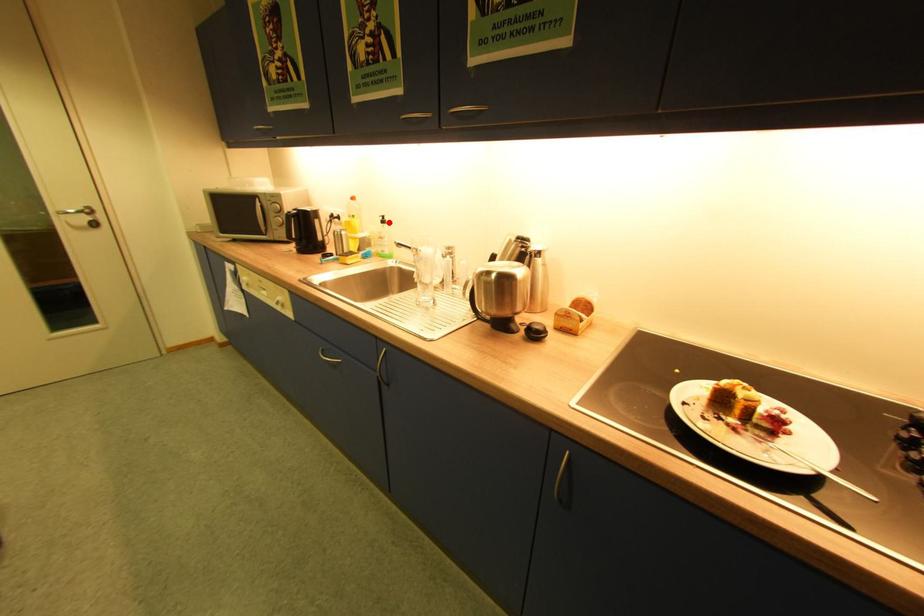
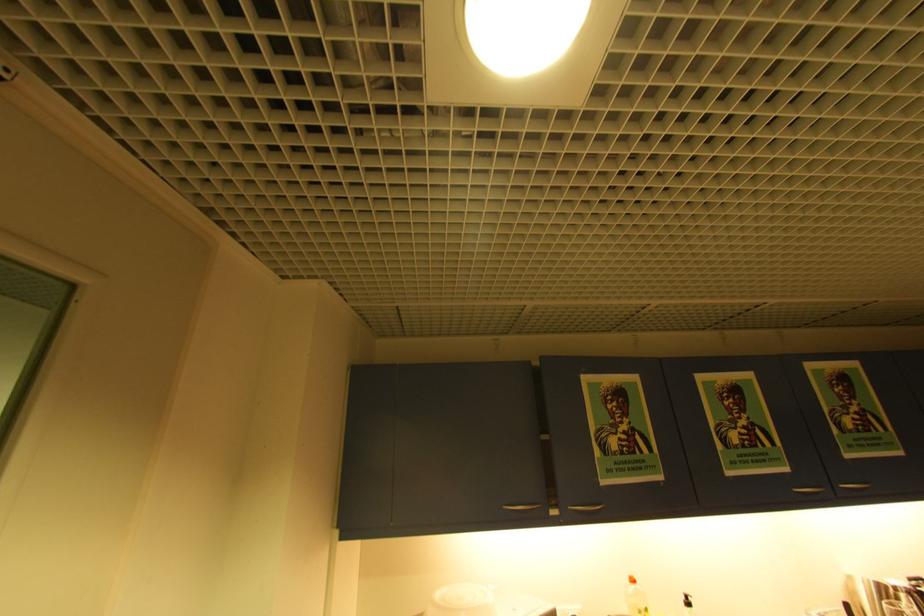
Locate, in the second image, the point that corresponds to the highlighted location in the first image.

(695, 605)